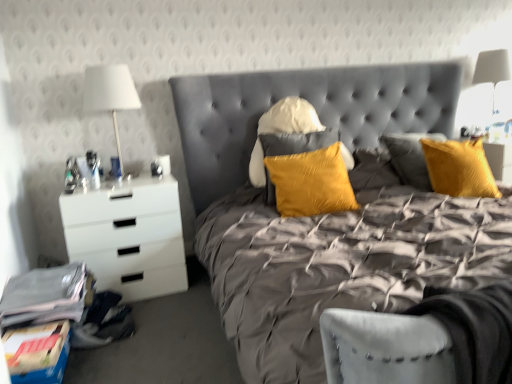
Question: Is white fabric lampshade at left, the second bedside lamp viewed from the back, shorter than satin yellow pillow at center?

Choices:
 (A) yes
 (B) no

Answer: (B)

Question: Is white fabric lampshade at left, which is the 1th bedside lamp in left-to-right order, oriented away from satin yellow pillow at center?

Choices:
 (A) no
 (B) yes

Answer: (A)

Question: From a real-world perspective, is white fabric lampshade at left, which appears as the first bedside lamp when viewed from the front, physically below satin yellow pillow at center?

Choices:
 (A) yes
 (B) no

Answer: (B)

Question: From the image's perspective, would you say white fabric lampshade at left, which is the 1th bedside lamp in left-to-right order, is shown under satin yellow pillow at center?

Choices:
 (A) yes
 (B) no

Answer: (B)

Question: From the image's perspective, is white fabric lampshade at left, which is the 1th bedside lamp in left-to-right order, above or below white fabric lampshade at upper right, the 1th bedside lamp positioned from the right?

Choices:
 (A) below
 (B) above

Answer: (A)

Question: Would you say white fabric lampshade at left, which appears as the first bedside lamp when viewed from the front, is inside or outside white fabric lampshade at upper right, positioned as the second bedside lamp in front-to-back order?

Choices:
 (A) outside
 (B) inside

Answer: (A)

Question: Based on their sizes in the image, would you say white fabric lampshade at left, which is counted as the second bedside lamp, starting from the right, is bigger or smaller than white fabric lampshade at upper right, which is the 2th bedside lamp from left to right?

Choices:
 (A) small
 (B) big

Answer: (B)

Question: Based on their positions, is white fabric lampshade at left, which is counted as the second bedside lamp, starting from the right, located to the left or right of white fabric lampshade at upper right, positioned as the second bedside lamp in front-to-back order?

Choices:
 (A) left
 (B) right

Answer: (A)

Question: Visually, is white fabric lampshade at left, which appears as the first bedside lamp when viewed from the front, positioned to the left or to the right of satin yellow pillow at center?

Choices:
 (A) right
 (B) left

Answer: (B)

Question: From the image's perspective, relative to satin yellow pillow at center, is white fabric lampshade at left, which is counted as the second bedside lamp, starting from the right, above or below?

Choices:
 (A) below
 (B) above

Answer: (B)

Question: Looking at the image, does white fabric lampshade at left, which is counted as the second bedside lamp, starting from the right, seem bigger or smaller compared to satin yellow pillow at center?

Choices:
 (A) small
 (B) big

Answer: (A)

Question: From a real-world perspective, is white fabric lampshade at left, which appears as the first bedside lamp when viewed from the front, physically located above or below satin yellow pillow at center?

Choices:
 (A) above
 (B) below

Answer: (A)

Question: Which is correct: white fabric lampshade at upper right, which is the 1th bedside lamp from back to front, is inside satin yellow pillow at center, or outside of it?

Choices:
 (A) inside
 (B) outside

Answer: (B)

Question: Looking at the image, does white fabric lampshade at upper right, which is the 2th bedside lamp from left to right, seem bigger or smaller compared to satin yellow pillow at center?

Choices:
 (A) small
 (B) big

Answer: (A)